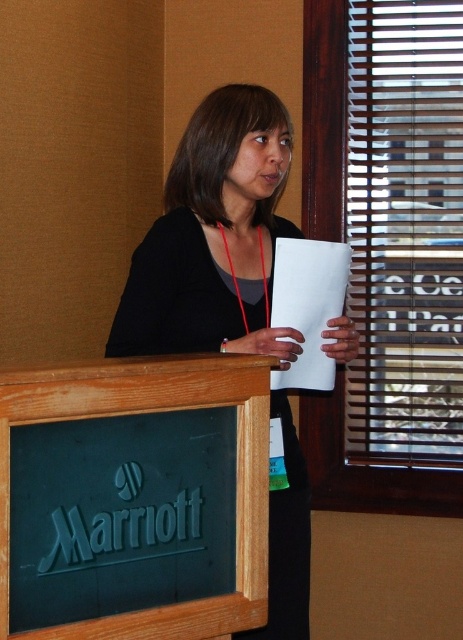
You are a photographer adjusting your camera settings to capture the scene. You notice two points in the image at coordinates point (271, 406) and point (187, 362). Which point should you focus on first if you want to ensure the closer one is sharp?

Point (187, 362) is closer to the camera than point (271, 406), so you should focus on point (187, 362) first to ensure it is sharp.